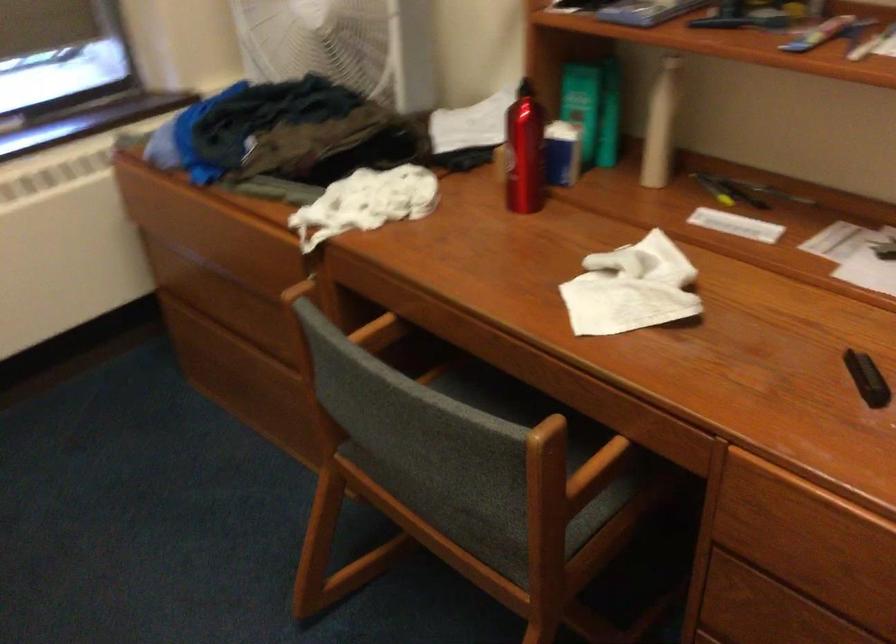
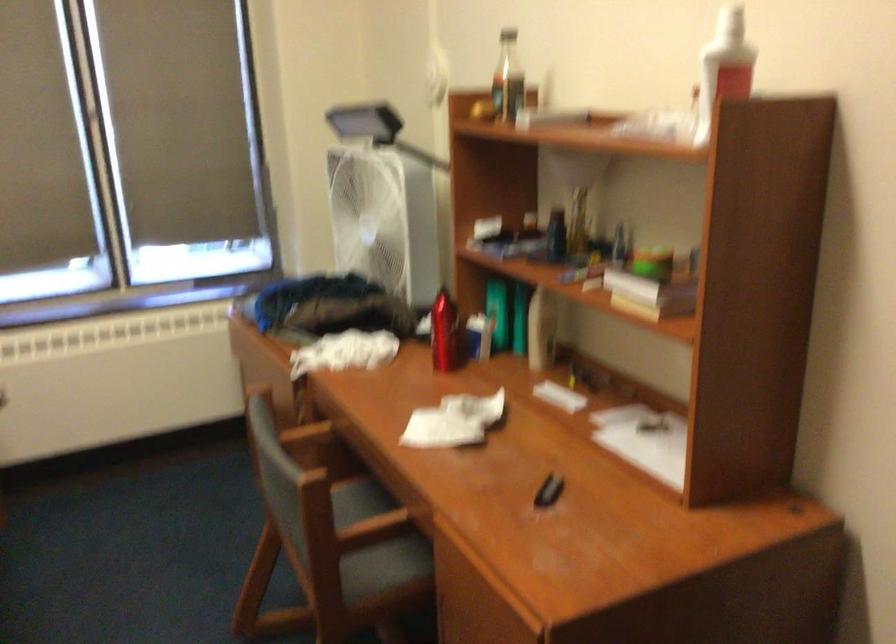
Find the pixel in the second image that matches [374,335] in the first image.

(306, 435)